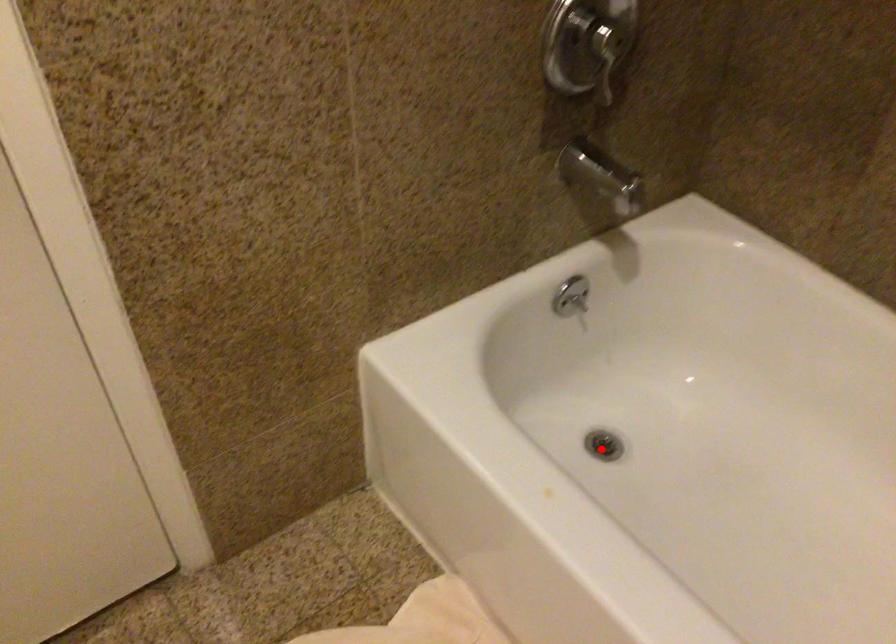
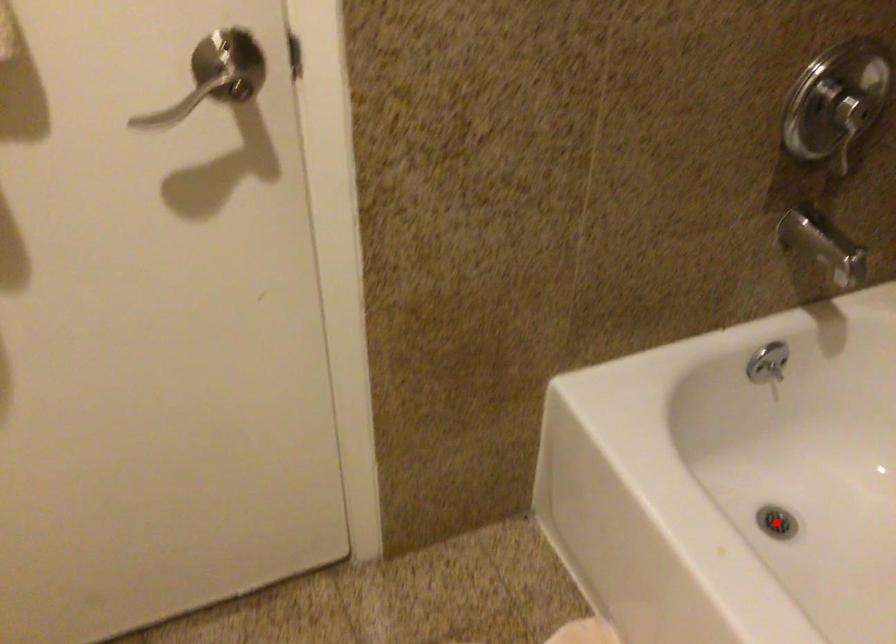
Consider the image. I am providing you with two images of the same scene from different viewpoints. A red point is marked on the first image and another point is marked on the second image. Is the red point in image1 aligned with the point shown in image2?

Yes